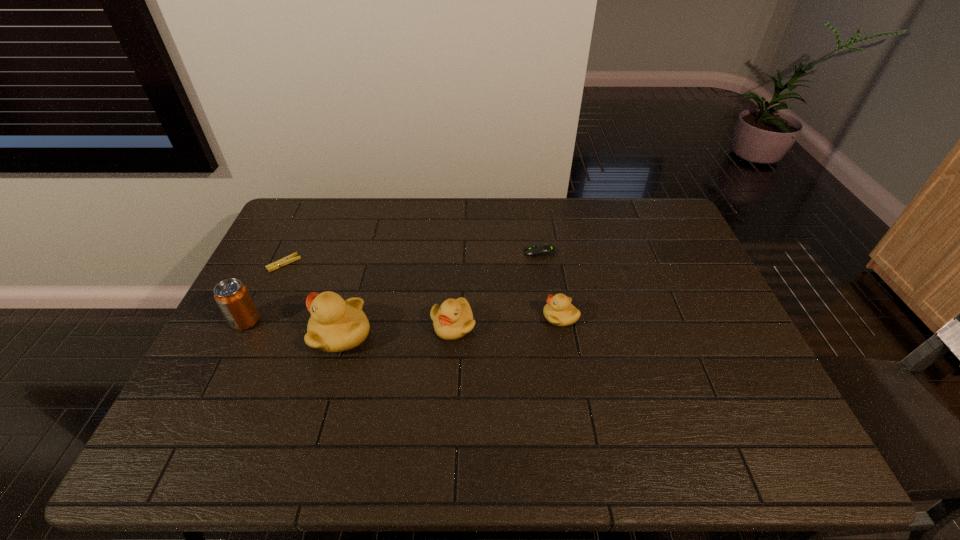
You are a GUI agent. You are given a task and a screenshot of the screen. Output one action in this format:
    pyautogui.click(x=<x>, y=<y>)
    Task: Click on the free space for a new duckling on the right
    The image size is (960, 540).
    Given the screenshot: What is the action you would take?
    pyautogui.click(x=664, y=309)